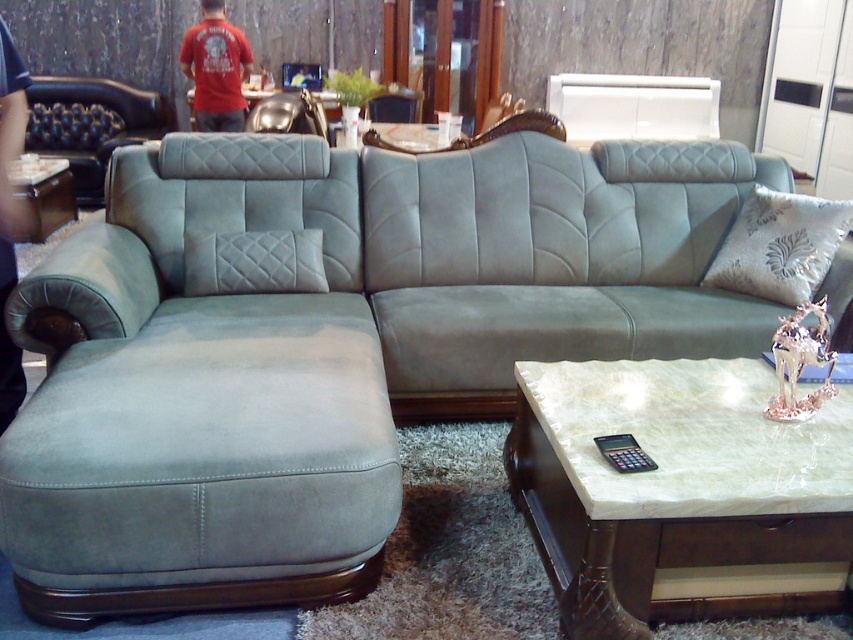
Is suede ottoman at lower left further to the viewer compared to metallic silver armchair at upper center?

No.

Is suede ottoman at lower left wider than metallic silver armchair at upper center?

Yes, suede ottoman at lower left is wider than metallic silver armchair at upper center.

Is point (120, 413) less distant than point (300, 104)?

Yes, it is in front of point (300, 104).

Where is `suede ottoman at lower left`? The width and height of the screenshot is (853, 640). suede ottoman at lower left is located at coordinates (204, 465).

Between marble-like coffee table at lower right and matte leather couch at left, which one has more height?

matte leather couch at left is taller.

Who is more distant from viewer, (846, 580) or (119, 115)?

Point (119, 115)

I want to click on marble-like coffee table at lower right, so click(680, 493).

Does point (41, 211) come farther from viewer compared to point (294, 104)?

No, it is not.

Is point (61, 184) closer to viewer compared to point (256, 112)?

No, (61, 184) is further to viewer.

Between point (48, 200) and point (277, 96), which one is positioned in front?

Point (48, 200)

Find the location of a particular element. matte wood side table at left is located at coordinates (44, 193).